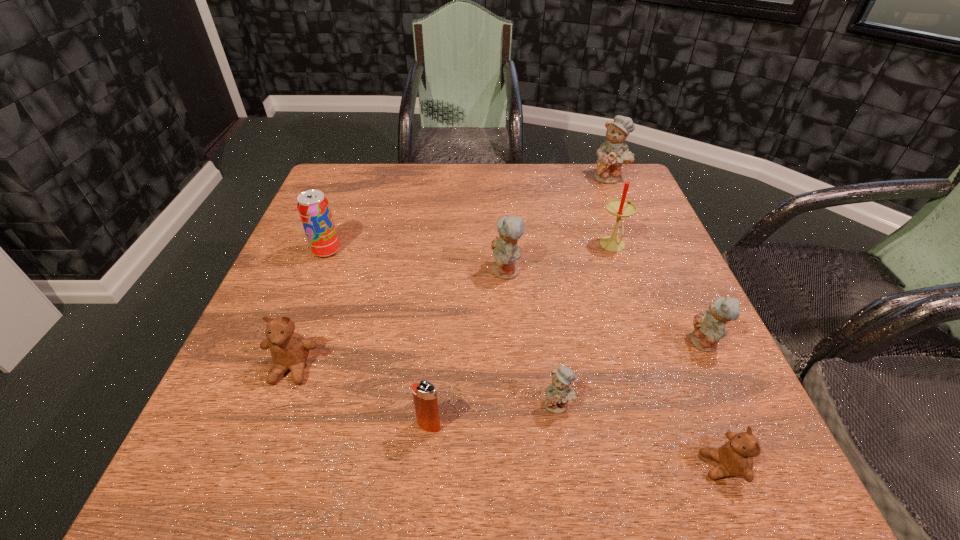
Image resolution: width=960 pixels, height=540 pixels. What are the coordinates of `the second nearest object` in the screenshot? It's located at (424, 393).

Where is `the fifth object from right to left`? This screenshot has height=540, width=960. the fifth object from right to left is located at coordinates (558, 393).

Locate an element on the screen. This screenshot has width=960, height=540. the third blue teddy bear from right to left is located at coordinates [x=558, y=393].

Locate an element on the screen. Image resolution: width=960 pixels, height=540 pixels. the nearer brown teddy bear is located at coordinates (735, 458).

This screenshot has width=960, height=540. Find the location of `the nearest object`. the nearest object is located at coordinates (735, 458).

Locate an element on the screen. Image resolution: width=960 pixels, height=540 pixels. vacant space positioned 0.290m on the front-facing side of the tallest teddy bear is located at coordinates (639, 251).

The width and height of the screenshot is (960, 540). Find the location of `free space located 0.200m on the left of the candle`. free space located 0.200m on the left of the candle is located at coordinates (515, 246).

You are a GUI agent. You are given a task and a screenshot of the screen. Output one action in this format:
    pyautogui.click(x=<x>, y=<y>)
    Task: Click on the blank space located 0.120m on the front-facing side of the second biggest blue teddy bear
    
    Given the screenshot: What is the action you would take?
    pyautogui.click(x=437, y=272)

The image size is (960, 540). In order to click on vacant space located on the front-facing side of the second biggest blue teddy bear in this screenshot , I will do `click(392, 272)`.

Identify the location of blank space located 0.130m on the front-facing side of the second biggest blue teddy bear. 432,272.